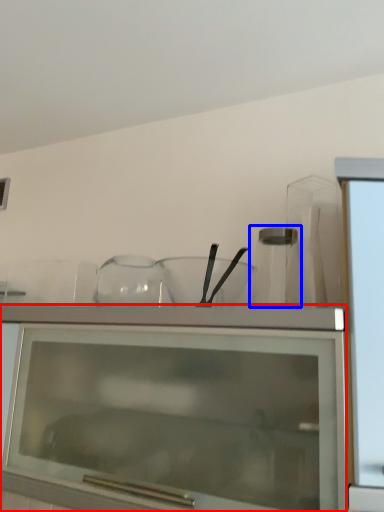
Question: Among these objects, which one is nearest to the camera, cabinetry (highlighted by a red box) or glass vase (highlighted by a blue box)?

Choices:
 (A) cabinetry
 (B) glass vase

Answer: (A)